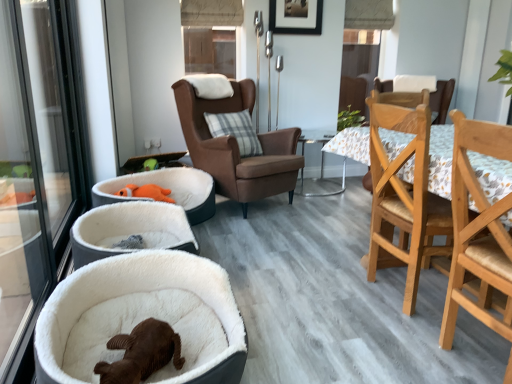
Question: Is white plush dog bed at lower left at the back of green leafy plant at upper center?

Choices:
 (A) yes
 (B) no

Answer: (B)

Question: From the image's perspective, does green leafy plant at upper center appear lower than white plush dog bed at lower left?

Choices:
 (A) no
 (B) yes

Answer: (A)

Question: Can you confirm if green leafy plant at upper center is positioned to the right of white plush dog bed at lower left?

Choices:
 (A) no
 (B) yes

Answer: (B)

Question: Does green leafy plant at upper center lie in front of white plush dog bed at lower left?

Choices:
 (A) no
 (B) yes

Answer: (A)

Question: Considering the relative sizes of green leafy plant at upper center and white plush dog bed at lower left in the image provided, is green leafy plant at upper center bigger than white plush dog bed at lower left?

Choices:
 (A) yes
 (B) no

Answer: (B)

Question: Is transparent glass window at upper center wider or thinner than floral fabric table at center?

Choices:
 (A) wide
 (B) thin

Answer: (B)

Question: From the image's perspective, is transparent glass window at upper center above or below floral fabric table at center?

Choices:
 (A) above
 (B) below

Answer: (A)

Question: Considering the positions of point (195, 3) and point (323, 157), is point (195, 3) closer or farther from the camera than point (323, 157)?

Choices:
 (A) farther
 (B) closer

Answer: (B)

Question: In the image, is transparent glass window at upper center on the left side or the right side of floral fabric table at center?

Choices:
 (A) left
 (B) right

Answer: (A)

Question: From a real-world perspective, is transparent glass window at upper center physically located above or below white plush dog bed at lower left?

Choices:
 (A) below
 (B) above

Answer: (B)

Question: Considering the positions of transparent glass window at upper center and white plush dog bed at lower left in the image, is transparent glass window at upper center taller or shorter than white plush dog bed at lower left?

Choices:
 (A) tall
 (B) short

Answer: (A)

Question: Is transparent glass window at upper center to the left or to the right of white plush dog bed at lower left in the image?

Choices:
 (A) left
 (B) right

Answer: (A)

Question: Considering the positions of point (234, 49) and point (208, 292), is point (234, 49) closer or farther from the camera than point (208, 292)?

Choices:
 (A) closer
 (B) farther

Answer: (B)

Question: From a real-world perspective, is brown leather armchair at center, the 3th chair in the front-to-back sequence, physically located above or below plaid fabric pillow at center?

Choices:
 (A) above
 (B) below

Answer: (B)

Question: From the image's perspective, relative to plaid fabric pillow at center, is brown leather armchair at center, the 3th chair in the front-to-back sequence, above or below?

Choices:
 (A) below
 (B) above

Answer: (A)